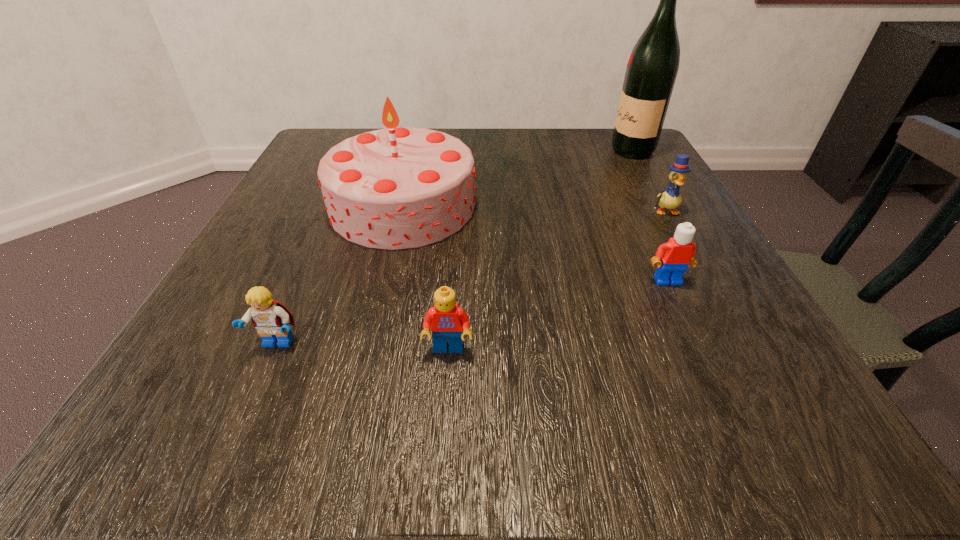
Find the location of a particular element. vacant space located 0.130m on the front-facing side of the tallest object is located at coordinates (553, 151).

Where is `vacant space located on the front of the birthday cake`? The width and height of the screenshot is (960, 540). vacant space located on the front of the birthday cake is located at coordinates (385, 285).

You are a GUI agent. You are given a task and a screenshot of the screen. Output one action in this format:
    pyautogui.click(x=<x>, y=<y>)
    Task: Click on the free location located on the face of the duckling, where the monocle is placed
    This screenshot has height=540, width=960.
    Given the screenshot: What is the action you would take?
    pyautogui.click(x=740, y=345)

Locate an element on the screen. The width and height of the screenshot is (960, 540). blank area located 0.110m on the face of the third nearest object is located at coordinates (697, 344).

Locate an element on the screen. Image resolution: width=960 pixels, height=540 pixels. vacant space situated on the face of the second Lego from right to left is located at coordinates (442, 442).

Identify the location of vacant space located on the front-facing side of the leftmost Lego. This screenshot has height=540, width=960. (239, 434).

Image resolution: width=960 pixels, height=540 pixels. I want to click on liquor that is at the far edge, so click(x=653, y=65).

The image size is (960, 540). What are the coordinates of `birthday cake located in the far edge section of the desktop` in the screenshot? It's located at (395, 188).

Where is `birthday cake present at the left edge`? Image resolution: width=960 pixels, height=540 pixels. birthday cake present at the left edge is located at coordinates (395, 188).

I want to click on Lego that is at the left edge, so click(x=271, y=318).